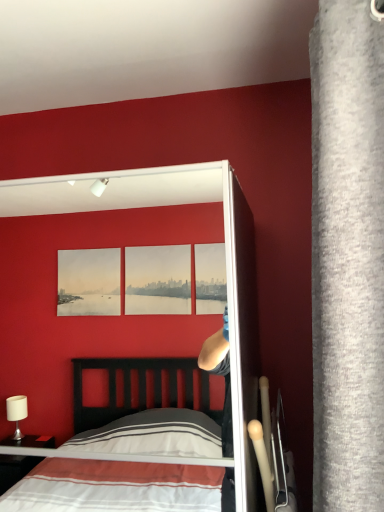
The height and width of the screenshot is (512, 384). Describe the element at coordinates (347, 256) in the screenshot. I see `gray fabric curtain at right` at that location.

What are the coordinates of `gray fabric curtain at right` in the screenshot? It's located at (347, 256).

In order to click on gray fabric curtain at right in this screenshot , I will do [x=347, y=256].